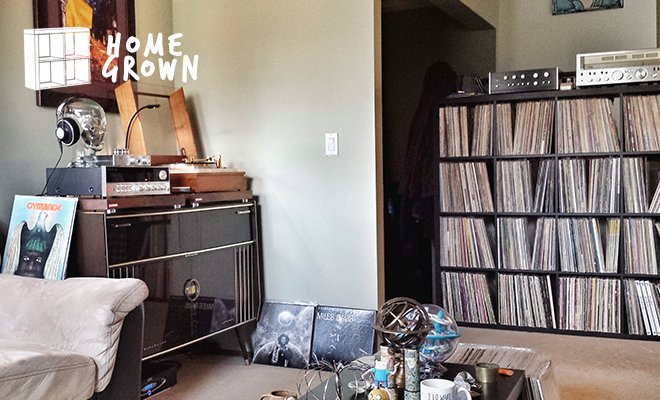
Find the location of a particular element. This screenshot has height=400, width=660. corner is located at coordinates (171, 18).